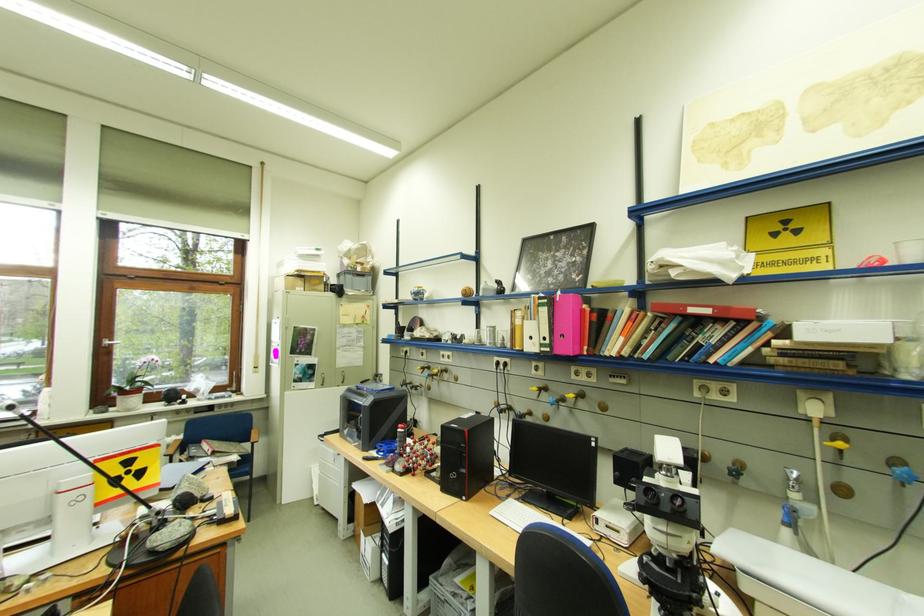
Locate an element on the screen. The width and height of the screenshot is (924, 616). silver window handle is located at coordinates (110, 342).